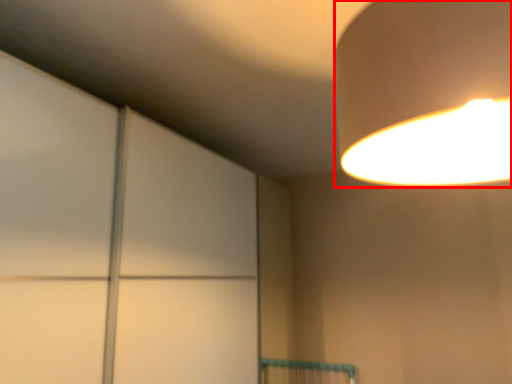
Question: From the image's perspective, considering the relative positions of lamp (annotated by the red box) and glass door in the image provided, where is lamp (annotated by the red box) located with respect to the staircase?

Choices:
 (A) below
 (B) above

Answer: (B)